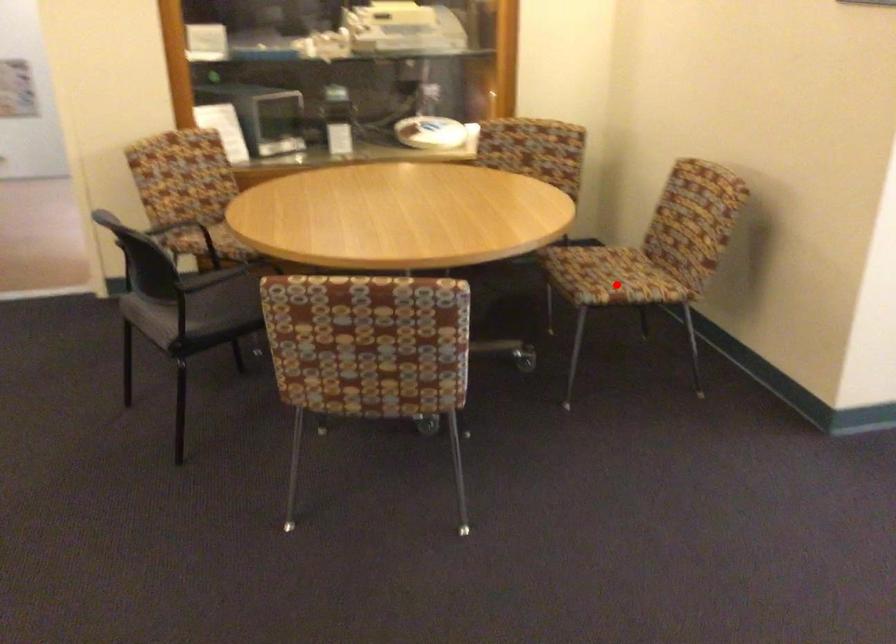
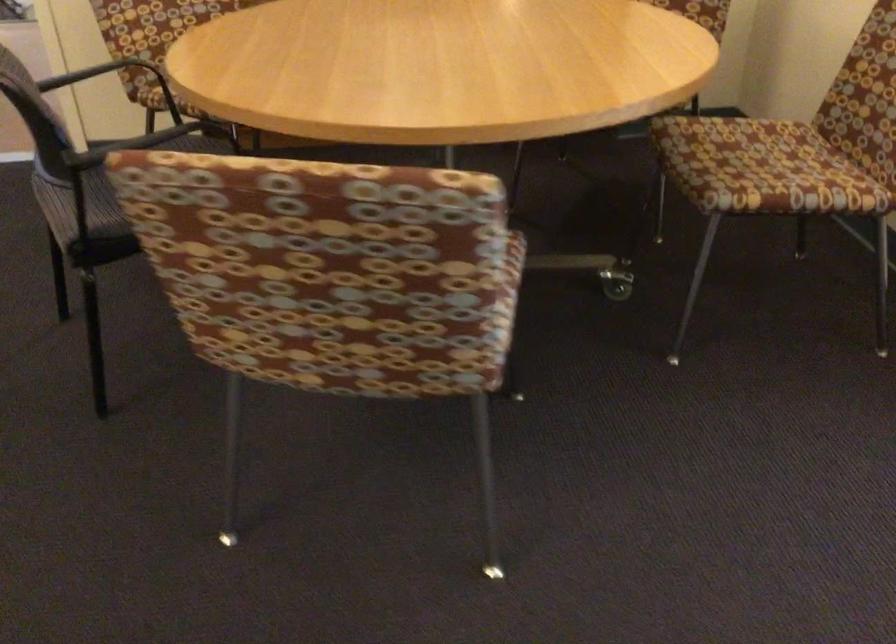
Find the pixel in the second image that matches the highlighted location in the first image.

(778, 187)